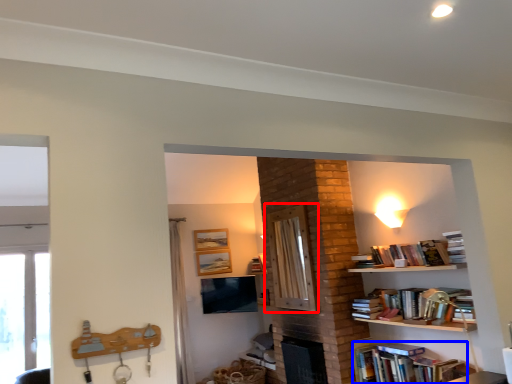
Question: Which object appears farthest to the camera in this image, screen door (highlighted by a red box) or book (highlighted by a blue box)?

Choices:
 (A) screen door
 (B) book

Answer: (A)